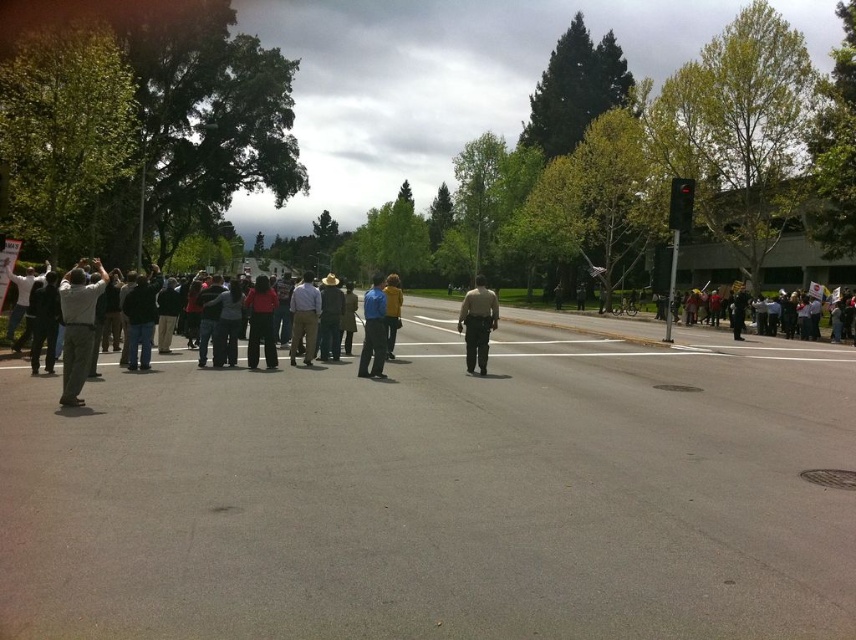
Is point (762, 330) more distant than point (681, 198)?

Yes.

Which is below, yellow fabric sign at right or red glass traffic light at upper right?

yellow fabric sign at right

Locate an element on the screen. This screenshot has height=640, width=856. yellow fabric sign at right is located at coordinates (764, 310).

Does light gray pants at left have a smaller size compared to light brown uniform at center?

Yes.

Image resolution: width=856 pixels, height=640 pixels. I want to click on light gray pants at left, so click(x=78, y=328).

Which is above, blue shirt at center or red glass traffic light at upper right?

red glass traffic light at upper right is above.

Looking at this image, can you confirm if blue shirt at center is thinner than red glass traffic light at upper right?

No.

In order to click on blue shirt at center in this screenshot , I will do `click(373, 330)`.